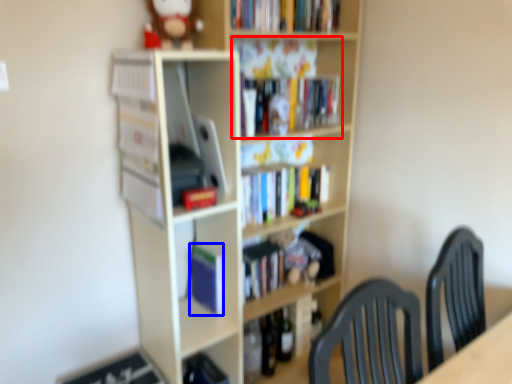
Question: Which object is closer to the camera taking this photo, book (highlighted by a red box) or paperback book (highlighted by a blue box)?

Choices:
 (A) book
 (B) paperback book

Answer: (A)